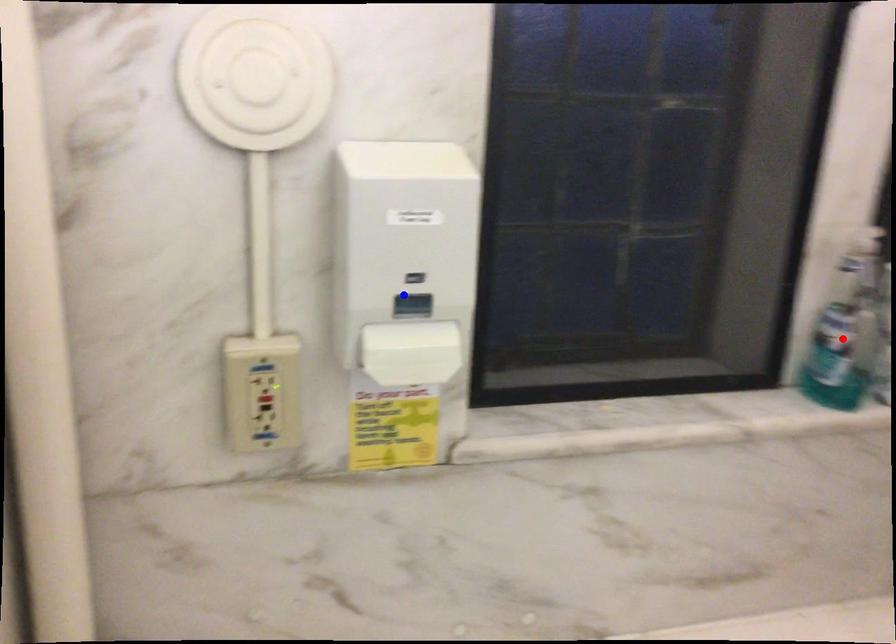
Question: Two points are marked on the image. Which point is closer to the camera?

Choices:
 (A) Blue point is closer.
 (B) Red point is closer.

Answer: (A)